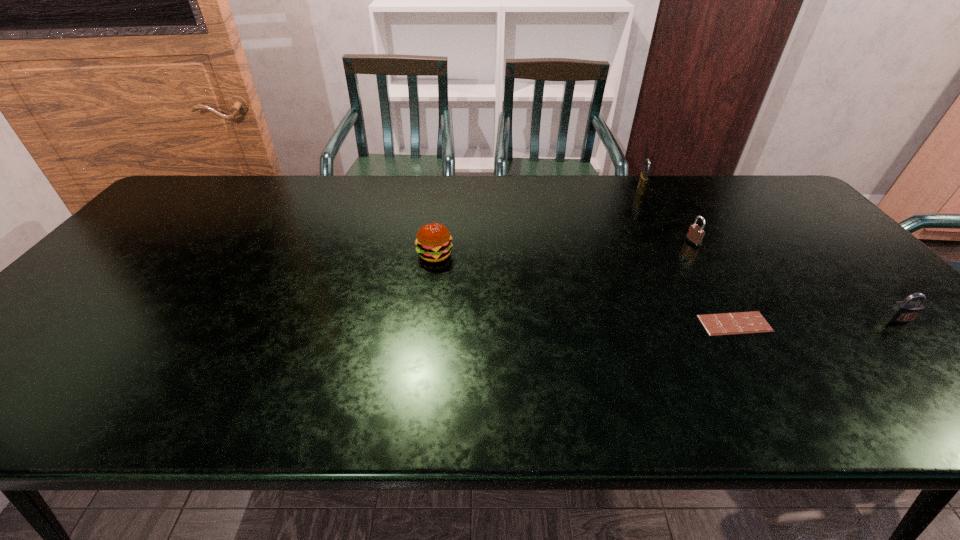
The height and width of the screenshot is (540, 960). I want to click on free space located on the front of the rightmost padlock near the keyhole, so click(x=951, y=372).

You are a GUI agent. You are given a task and a screenshot of the screen. Output one action in this format:
    pyautogui.click(x=<x>, y=<y>)
    Task: Click on the free space located 0.180m on the left of the shortest object
    The width and height of the screenshot is (960, 540).
    Given the screenshot: What is the action you would take?
    pyautogui.click(x=624, y=323)

Image resolution: width=960 pixels, height=540 pixels. Identify the location of object positioned at the far edge. (643, 179).

Locate an element on the screen. object that is at the right edge is located at coordinates (905, 311).

The image size is (960, 540). In the image, there is a desktop. Identify the location of vacant space at the far edge. (551, 197).

This screenshot has height=540, width=960. In order to click on free space at the near edge of the desktop in this screenshot , I will do `click(443, 409)`.

Locate an element on the screen. The width and height of the screenshot is (960, 540). vacant space at the left edge of the desktop is located at coordinates (157, 249).

Locate an element on the screen. This screenshot has height=540, width=960. vacant space at the right edge of the desktop is located at coordinates (811, 238).

Find the location of a particular element. The image size is (960, 540). free point at the far left corner is located at coordinates (198, 191).

Find the location of a particular element. The width and height of the screenshot is (960, 540). free point at the near right corner is located at coordinates (929, 406).